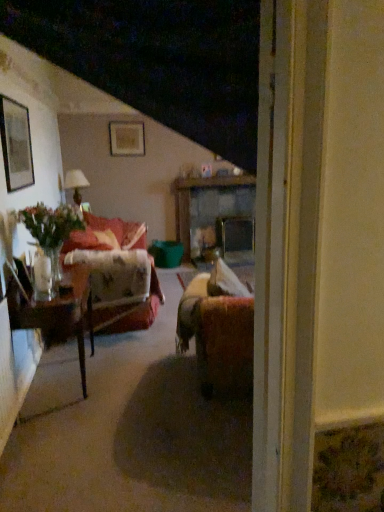
The image size is (384, 512). Describe the element at coordinates (75, 184) in the screenshot. I see `matte white lampshade at left` at that location.

This screenshot has width=384, height=512. What are the coordinates of `velvet red couch at left` in the screenshot? It's located at (129, 310).

This screenshot has width=384, height=512. What do you see at coordinates (16, 144) in the screenshot? I see `matte black picture frame at upper left, marked as the 2th picture frame in a back-to-front arrangement` at bounding box center [16, 144].

You are a GUI agent. You are given a task and a screenshot of the screen. Output one action in this format:
    pyautogui.click(x=<x>, y=<y>)
    Task: Click on the wooden glossy table at left, the first table when ordered from front to back
    The image size is (384, 512).
    Given the screenshot: What is the action you would take?
    pyautogui.click(x=58, y=315)

Image resolution: width=384 pixels, height=512 pixels. What are the coordinates of `matte gold picture frame at upper center, which ranks as the first picture frame in top-to-bottom order` in the screenshot? It's located at (126, 138).

Locate an element on the screen. matte white lampshade at left is located at coordinates (75, 184).

This screenshot has width=384, height=512. In order to click on table that appears in front of the velvet red couch at left in this screenshot , I will do `click(58, 315)`.

Considering the relative positions of wooden glossy table at left, the first table when ordered from front to back, and velvet red couch at left in the image provided, is wooden glossy table at left, the first table when ordered from front to back, to the right of velvet red couch at left from the viewer's perspective?

No, wooden glossy table at left, the first table when ordered from front to back, is not to the right of velvet red couch at left.

Measure the distance from wooden glossy table at left, the second table when ordered from top to bottom, to velvet red couch at left.

The distance of wooden glossy table at left, the second table when ordered from top to bottom, from velvet red couch at left is 1.23 meters.

Can you confirm if wooden glossy table at left, which is counted as the first table, starting from the left, is taller than velvet red couch at left?

No, wooden glossy table at left, which is counted as the first table, starting from the left, is not taller than velvet red couch at left.

Consider the image. Does velvet red couch at left have a larger size compared to matte white lampshade at left?

Yes.

From the image's perspective, does velvet red couch at left appear higher than matte white lampshade at left?

Incorrect, from the image's perspective, velvet red couch at left is lower than matte white lampshade at left.

Which is behind, point (127, 247) or point (77, 174)?

The point (77, 174) is more distant.

Is velvet red couch at left oriented towards matte white lampshade at left?

No, velvet red couch at left is not aimed at matte white lampshade at left.

Based on the photo, from the image's perspective, does matte gold picture frame at upper center, which ranks as the 1th picture frame in back-to-front order, appear higher than velvet red couch at left?

Yes, from the image's perspective, matte gold picture frame at upper center, which ranks as the 1th picture frame in back-to-front order, is above velvet red couch at left.

Where is `picture frame behind the velvet red couch at left`? The image size is (384, 512). picture frame behind the velvet red couch at left is located at coordinates tap(126, 138).

Can you confirm if matte gold picture frame at upper center, the 2th picture frame in the left-to-right sequence, is taller than velvet red couch at left?

Incorrect, the height of matte gold picture frame at upper center, the 2th picture frame in the left-to-right sequence, is not larger of that of velvet red couch at left.

Is matte gold picture frame at upper center, the 2th picture frame in the left-to-right sequence, oriented away from velvet red couch at left?

No.

Looking at this image, in terms of height, does velvet red couch at left look taller or shorter compared to wooden table at center, which appears as the second table when viewed from the front?

In the image, velvet red couch at left appears to be shorter than wooden table at center, which appears as the second table when viewed from the front.

Can you tell me how much velvet red couch at left and wooden table at center, which appears as the second table when viewed from the front, differ in facing direction?

There is a 88.8-degree angle between the facing directions of velvet red couch at left and wooden table at center, which appears as the second table when viewed from the front.

Is velvet red couch at left next to wooden table at center, which is the 2th table from bottom to top?

velvet red couch at left and wooden table at center, which is the 2th table from bottom to top, are not in contact.

Looking at this image, relative to wooden table at center, which is the 2th table from bottom to top, is velvet red couch at left in front or behind?

velvet red couch at left is in front of wooden table at center, which is the 2th table from bottom to top.

I want to click on the 1st picture frame behind the wooden glossy table at left, the second table when ordered from top to bottom, starting your count from the anchor, so click(16, 144).

Between matte black picture frame at upper left, the first picture frame positioned from the front, and wooden glossy table at left, which is the second table in back-to-front order, which one has larger size?

With larger size is wooden glossy table at left, which is the second table in back-to-front order.

From the image's perspective, is matte black picture frame at upper left, which is counted as the 1th picture frame, starting from the bottom, over wooden glossy table at left, which is counted as the first table, starting from the left?

Indeed, from the image's perspective, matte black picture frame at upper left, which is counted as the 1th picture frame, starting from the bottom, is shown above wooden glossy table at left, which is counted as the first table, starting from the left.

From a real-world perspective, is matte black picture frame at upper left, the 2th picture frame in the top-to-bottom sequence, above or below wooden glossy table at left, acting as the 2th table starting from the right?

Clearly, from a real-world perspective, matte black picture frame at upper left, the 2th picture frame in the top-to-bottom sequence, is above wooden glossy table at left, acting as the 2th table starting from the right.

Are matte black picture frame at upper left, the 1th picture frame positioned from the left, and matte white lampshade at left beside each other?

They are not placed beside each other.

From a real-world perspective, which object rests below the other?

matte white lampshade at left.

Considering the relative sizes of matte black picture frame at upper left, which is counted as the 1th picture frame, starting from the bottom, and matte white lampshade at left in the image provided, is matte black picture frame at upper left, which is counted as the 1th picture frame, starting from the bottom, taller than matte white lampshade at left?

Yes, matte black picture frame at upper left, which is counted as the 1th picture frame, starting from the bottom, is taller than matte white lampshade at left.

Which is in front, point (9, 290) or point (188, 179)?

The point (9, 290) is closer to the camera.

In the scene shown: Is wooden glossy table at left, the second table when ordered from top to bottom, not within wooden table at center, acting as the first table starting from the top?

Absolutely, wooden glossy table at left, the second table when ordered from top to bottom, is external to wooden table at center, acting as the first table starting from the top.

Considering the sizes of objects wooden glossy table at left, the 1th table positioned from the bottom, and wooden table at center, which appears as the second table when viewed from the front, in the image provided, who is smaller, wooden glossy table at left, the 1th table positioned from the bottom, or wooden table at center, which appears as the second table when viewed from the front,?

wooden glossy table at left, the 1th table positioned from the bottom, is smaller.

Locate an element on the screen. table below the velvet red couch at left (from the image's perspective) is located at coordinates (58, 315).

The width and height of the screenshot is (384, 512). What are the coordinates of `studio couch that is on the right side of matte white lampshade at left` in the screenshot? It's located at (129, 310).

Considering their positions, is wooden table at center, the 2th table in the left-to-right sequence, positioned closer to wooden glossy table at left, which is counted as the first table, starting from the left, than matte black picture frame at upper left, the first picture frame positioned from the front?

The object closer to wooden glossy table at left, which is counted as the first table, starting from the left, is matte black picture frame at upper left, the first picture frame positioned from the front.

Based on their spatial positions, is matte white lampshade at left or matte gold picture frame at upper center, which ranks as the first picture frame in top-to-bottom order, closer to velvet red couch at left?

The object closer to velvet red couch at left is matte white lampshade at left.

Looking at the image, which one is located closer to matte black picture frame at upper left, the 1th picture frame positioned from the left, matte white lampshade at left or wooden table at center, which is the 2th table from bottom to top?

matte white lampshade at left lies closer to matte black picture frame at upper left, the 1th picture frame positioned from the left, than the other object.

From the image, which object appears to be nearer to velvet red couch at left, wooden table at center, which is the 2th table from bottom to top, or matte white lampshade at left?

matte white lampshade at left.

Based on their spatial positions, is wooden glossy table at left, the second table when ordered from top to bottom, or matte black picture frame at upper left, the 1th picture frame positioned from the left, closer to wooden table at center, which ranks as the 1th table in back-to-front order?

matte black picture frame at upper left, the 1th picture frame positioned from the left, is closer to wooden table at center, which ranks as the 1th table in back-to-front order.

From the picture: Which object lies nearer to the anchor point matte white lampshade at left, wooden table at center, acting as the first table starting from the top, or velvet red couch at left?

Based on the image, velvet red couch at left appears to be nearer to matte white lampshade at left.

Based on their spatial positions, is matte black picture frame at upper left, the 2th picture frame in the top-to-bottom sequence, or matte gold picture frame at upper center, which is counted as the 1th picture frame, starting from the right, further from wooden table at center, which appears as the first table when viewed from the right?

The object further to wooden table at center, which appears as the first table when viewed from the right, is matte black picture frame at upper left, the 2th picture frame in the top-to-bottom sequence.

Estimate the real-world distances between objects in this image. Which object is closer to wooden glossy table at left, the first table when ordered from front to back, velvet red couch at left or matte black picture frame at upper left, marked as the 2th picture frame in a back-to-front arrangement?

The object closer to wooden glossy table at left, the first table when ordered from front to back, is matte black picture frame at upper left, marked as the 2th picture frame in a back-to-front arrangement.

This screenshot has width=384, height=512. Identify the location of lamp between wooden glossy table at left, the first table when ordered from front to back, and wooden table at center, which appears as the second table when viewed from the front, along the z-axis. (75, 184).

You are a GUI agent. You are given a task and a screenshot of the screen. Output one action in this format:
    pyautogui.click(x=<x>, y=<y>)
    Task: Click on the studio couch between wooden glossy table at left, the first table when ordered from front to back, and matte gold picture frame at upper center, marked as the 2th picture frame in a front-to-back arrangement, in the front-back direction
    Image resolution: width=384 pixels, height=512 pixels.
    Given the screenshot: What is the action you would take?
    pyautogui.click(x=129, y=310)

Locate an element on the screen. This screenshot has width=384, height=512. studio couch located between matte black picture frame at upper left, the 2th picture frame from the right, and matte white lampshade at left in the depth direction is located at coordinates (129, 310).

Image resolution: width=384 pixels, height=512 pixels. In order to click on picture frame positioned between matte black picture frame at upper left, the 2th picture frame in the top-to-bottom sequence, and wooden table at center, which ranks as the 1th table in back-to-front order, from near to far in this screenshot , I will do `click(126, 138)`.